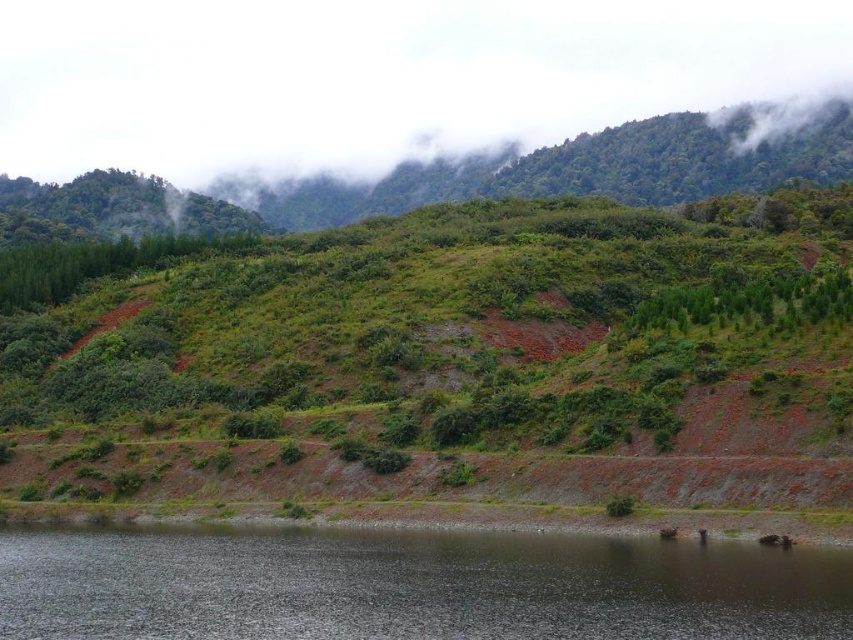
You are standing at the edge of the dark reflective water at lower center and want to walk towards the green grassy hillside at center. Which direction should you head?

You should head towards the green grassy hillside at center. Since the green grassy hillside at center is closer to you than the dark reflective water at lower center, you can walk towards it directly.

You are standing at the point marked as point (x=463, y=356) in the image. Based on the scene description, what type of terrain are you currently standing on?

You are standing on a green grassy hillside at center.

You are standing at the center of the image and want to walk towards the green grassy hillside at center. In which direction should you move relative to your current position?

The green grassy hillside at center is already at your current position since you are standing at the center of the image, so you don not need to move in any direction.